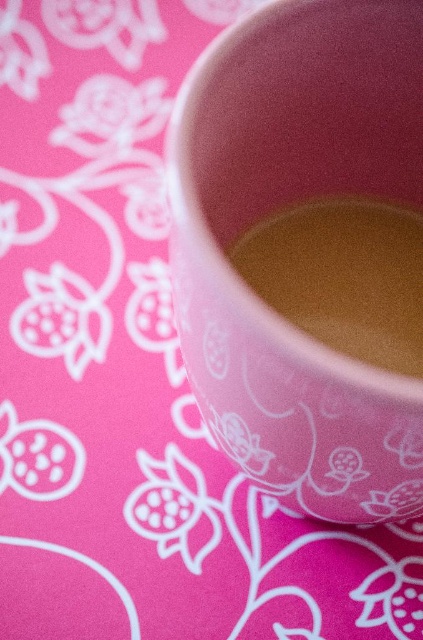
Question: Can you confirm if matte pink cup at center is positioned below golden matte liquid at center?

Choices:
 (A) no
 (B) yes

Answer: (A)

Question: Which object appears closest to the camera in this image?

Choices:
 (A) golden matte liquid at center
 (B) matte pink cup at center

Answer: (B)

Question: Is matte pink cup at center bigger than golden matte liquid at center?

Choices:
 (A) no
 (B) yes

Answer: (B)

Question: Is matte pink cup at center to the left of golden matte liquid at center from the viewer's perspective?

Choices:
 (A) yes
 (B) no

Answer: (A)